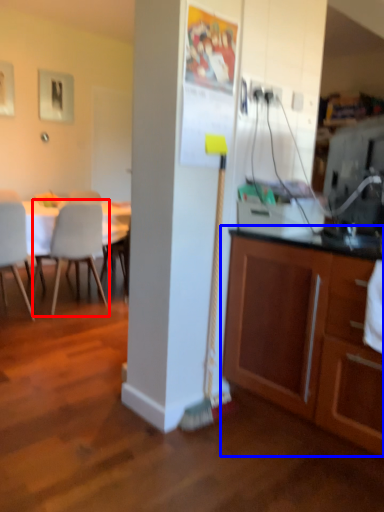
Question: Which point is further to the camera, chair (highlighted by a red box) or cabinetry (highlighted by a blue box)?

Choices:
 (A) chair
 (B) cabinetry

Answer: (A)